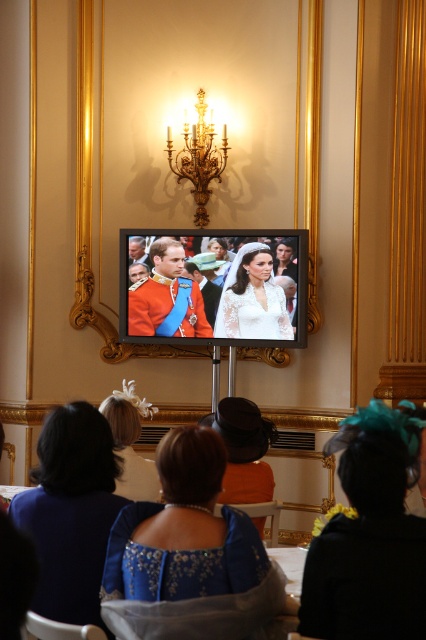
Which is more to the right, blue satin dress at lower center or gold/gilded chandelier at upper center?

Positioned to the right is blue satin dress at lower center.

Is point (233, 547) behind point (207, 188)?

No, (233, 547) is in front of (207, 188).

This screenshot has height=640, width=426. I want to click on blue satin dress at lower center, so click(187, 554).

This screenshot has width=426, height=640. What do you see at coordinates (215, 288) in the screenshot?
I see `matte orange uniform at center` at bounding box center [215, 288].

Is matte orange uniform at center positioned behind gold/gilded chandelier at upper center?

No, it is not.

Locate an element on the screen. This screenshot has height=640, width=426. matte orange uniform at center is located at coordinates (215, 288).

Does matte orange uniform at center appear on the left side of lace fabric dress at center?

Correct, you'll find matte orange uniform at center to the left of lace fabric dress at center.

Between matte orange uniform at center and lace fabric dress at center, which one is positioned higher?

Positioned higher is matte orange uniform at center.

Where is `matte orange uniform at center`? The height and width of the screenshot is (640, 426). matte orange uniform at center is located at coordinates (215, 288).